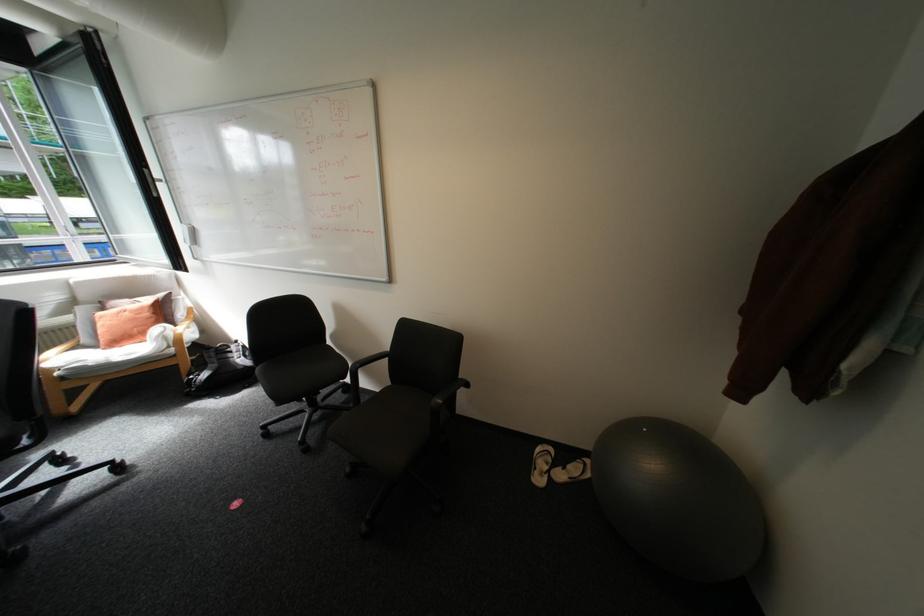
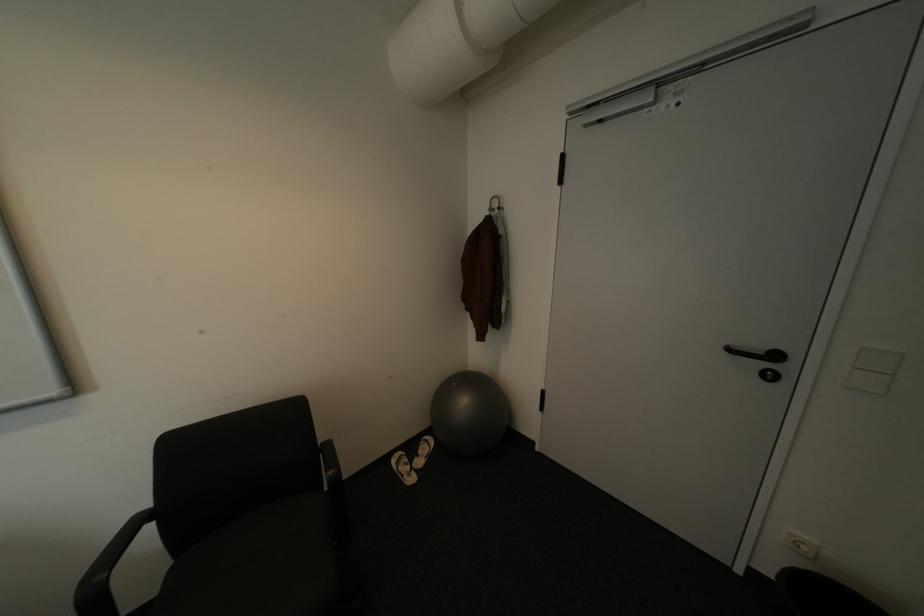
Locate, in the second image, the point that corresponds to point 654,430 in the first image.

(464, 384)